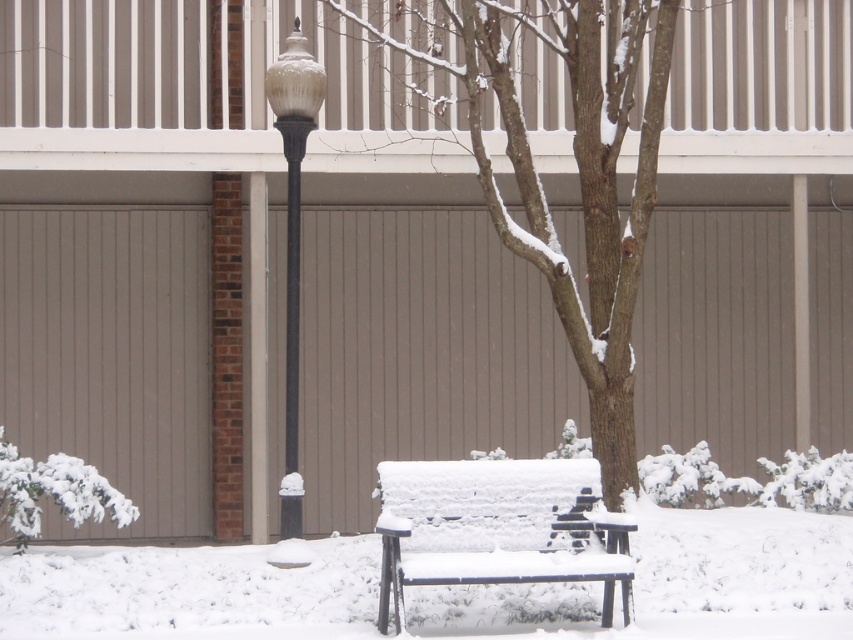
Question: Which object is farther from the camera taking this photo?

Choices:
 (A) matte gray garage door at left
 (B) smooth brown tree trunk at center

Answer: (A)

Question: Is matte gray garage door at left further to the viewer compared to snow-covered wood bench at center?

Choices:
 (A) no
 (B) yes

Answer: (B)

Question: Among these points, which one is nearest to the camera?

Choices:
 (A) (596, 195)
 (B) (74, 435)

Answer: (A)

Question: Which point is closer to the camera?

Choices:
 (A) (604, 116)
 (B) (755, 124)
 (C) (517, 532)

Answer: (C)

Question: Is white textured balcony at upper center smaller than matte gray garage door at left?

Choices:
 (A) no
 (B) yes

Answer: (A)

Question: Is smooth brown tree trunk at center wider than snow-covered wood bench at center?

Choices:
 (A) no
 (B) yes

Answer: (B)